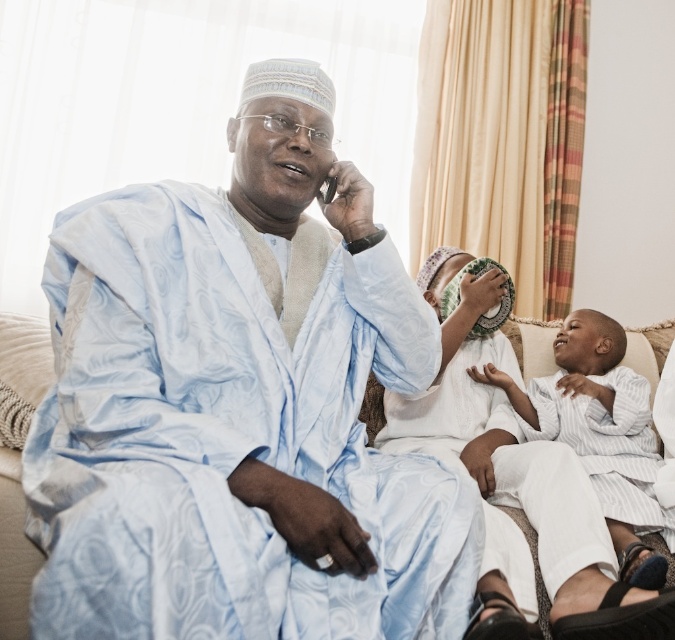
Question: Which point is closer to the camera taking this photo?

Choices:
 (A) [x=371, y=225]
 (B) [x=570, y=339]
 (C) [x=477, y=394]

Answer: (A)

Question: In this image, where is white striped cloth at center located relative to white striped robe at lower right?

Choices:
 (A) above
 (B) below

Answer: (A)

Question: Which is farther from the white striped cloth at lower right?

Choices:
 (A) satin blue robe at center
 (B) white striped cloth at center

Answer: (A)

Question: Which object is farther from the camera taking this photo?

Choices:
 (A) white striped robe at lower right
 (B) white striped cloth at center

Answer: (A)

Question: Is white striped cloth at center thinner than white striped robe at lower right?

Choices:
 (A) no
 (B) yes

Answer: (A)

Question: Does satin blue robe at center have a lesser width compared to white striped cloth at lower right?

Choices:
 (A) no
 (B) yes

Answer: (A)